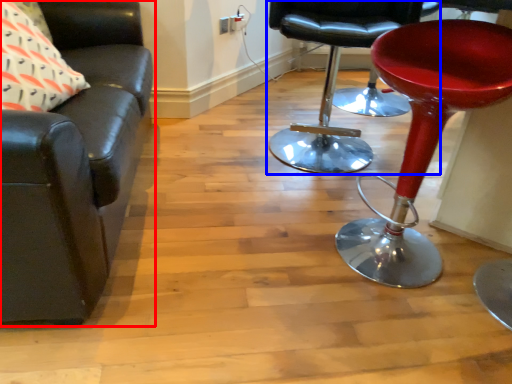
Question: Which object appears farthest to the camera in this image, chair (highlighted by a red box) or chair (highlighted by a blue box)?

Choices:
 (A) chair
 (B) chair

Answer: (B)